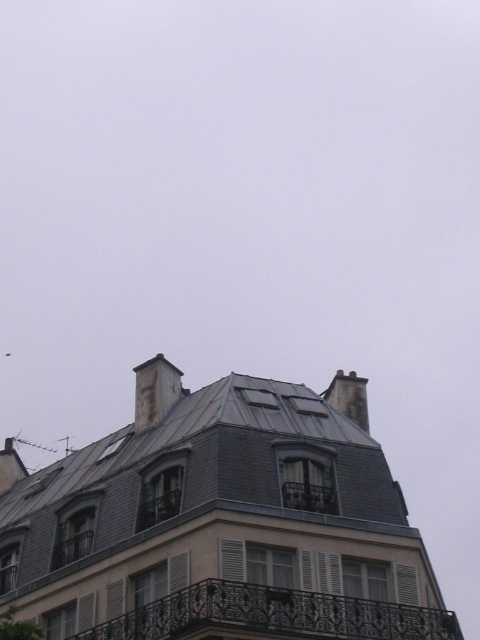
Measure the distance from black wrought iron balcony at center to dark gray stone chimney at upper center.

black wrought iron balcony at center and dark gray stone chimney at upper center are 74.64 feet apart from each other.

Between black wrought iron balcony at center and dark gray stone chimney at upper center, which one appears on the left side from the viewer's perspective?

From the viewer's perspective, dark gray stone chimney at upper center appears more on the left side.

Locate an element on the screen. Image resolution: width=480 pixels, height=640 pixels. black wrought iron balcony at center is located at coordinates coord(274,616).

The width and height of the screenshot is (480, 640). I want to click on black wrought iron balcony at center, so click(x=274, y=616).

Can you confirm if dark gray stone chimney at upper center is shorter than dark gray stone chimney at upper right?

Yes, dark gray stone chimney at upper center is shorter than dark gray stone chimney at upper right.

Who is positioned more to the right, dark gray stone chimney at upper center or dark gray stone chimney at upper right?

Positioned to the right is dark gray stone chimney at upper right.

Who is more distant from viewer, (134, 376) or (348, 397)?

Point (134, 376)

Identify the location of dark gray stone chimney at upper center. The height and width of the screenshot is (640, 480). (155, 390).

Between point (334, 396) and point (305, 496), which one is positioned behind?

Positioned behind is point (334, 396).

Does dark gray stone chimney at upper right have a greater height compared to metallic balcony at center?

Yes.

Which is behind, point (351, 408) or point (324, 513)?

Positioned behind is point (351, 408).

The image size is (480, 640). What are the coordinates of `dark gray stone chimney at upper right` in the screenshot? It's located at (348, 397).